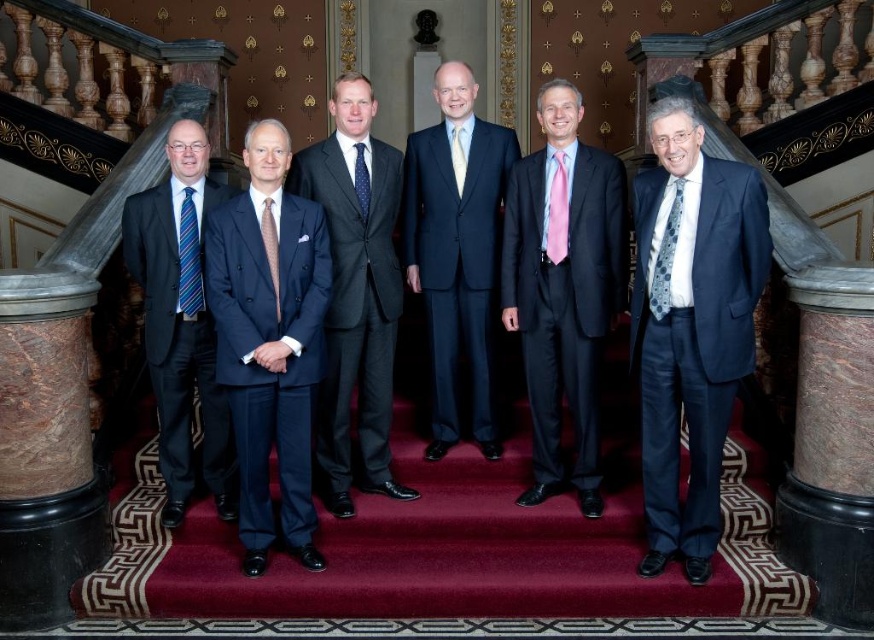
Does pink silk tie at center appear on the left side of white silk tie at center?

No, pink silk tie at center is not to the left of white silk tie at center.

Between pink silk tie at center and white silk tie at center, which one is positioned higher?

Positioned higher is white silk tie at center.

What are the coordinates of `pink silk tie at center` in the screenshot? It's located at (563, 291).

Does matte navy suit at center lie in front of dark gray dotted tie at right?

No, matte navy suit at center is further to the viewer.

Between matte navy suit at center and dark gray dotted tie at right, which one is positioned higher?

matte navy suit at center is higher up.

Who is more forward, [438,291] or [656,292]?

Point [656,292] is in front.

The width and height of the screenshot is (874, 640). I want to click on matte navy suit at center, so click(x=456, y=252).

How much distance is there between dark gray dotted tie at right and pink satin tie at center?

30.50 inches

Locate an element on the screen. dark gray dotted tie at right is located at coordinates (664, 257).

Where is `dark gray dotted tie at right`? dark gray dotted tie at right is located at coordinates (664, 257).

You are a GUI agent. You are given a task and a screenshot of the screen. Output one action in this format:
    pyautogui.click(x=<x>, y=<y>)
    Task: Click on the dark gray dotted tie at right
    The width and height of the screenshot is (874, 640).
    Given the screenshot: What is the action you would take?
    pyautogui.click(x=664, y=257)